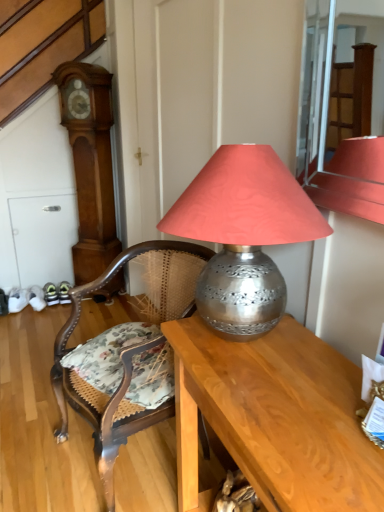
At what (x,y) coordinates should I click in order to perform the action: click on vacant space in front of metallic silver lamp at center. Please return your answer as a coordinate pair (x, y). Looking at the image, I should click on (298, 422).